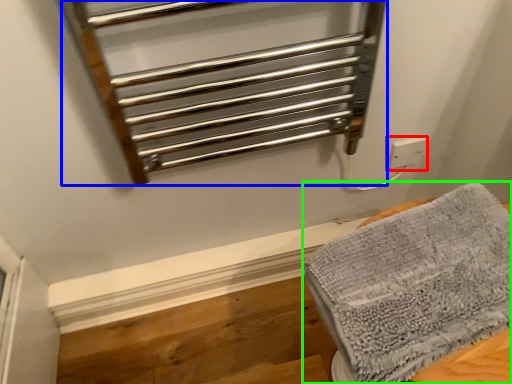
Question: Which object is the farthest from electric outlet (highlighted by a red box)? Choose among these: cage (highlighted by a blue box) or towel (highlighted by a green box).

Choices:
 (A) cage
 (B) towel

Answer: (B)